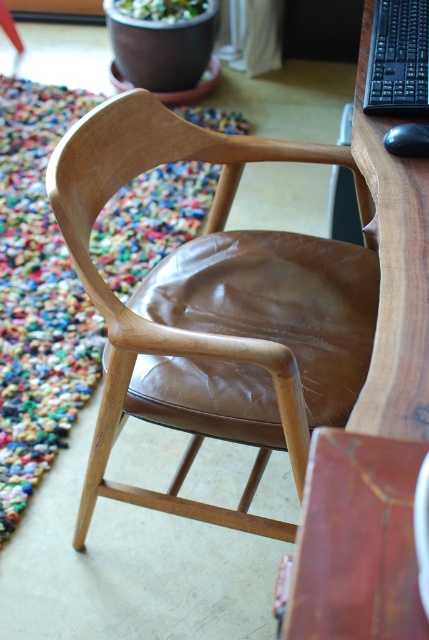
Question: Which of the following is the farthest from the observer?

Choices:
 (A) [211, 417]
 (B) [407, 289]

Answer: (A)

Question: Which point is closer to the camera taking this photo?

Choices:
 (A) (359, 109)
 (B) (232, 168)
 (C) (414, 4)

Answer: (A)

Question: Is the position of brown leather armchair at center more distant than that of wooden computer desk at right?

Choices:
 (A) no
 (B) yes

Answer: (B)

Question: Is brown leather armchair at center smaller than wooden computer desk at right?

Choices:
 (A) no
 (B) yes

Answer: (A)

Question: Is brown leather armchair at center to the left of black plastic keyboard at upper right from the viewer's perspective?

Choices:
 (A) no
 (B) yes

Answer: (B)

Question: Which point is closer to the camera?

Choices:
 (A) (353, 150)
 (B) (187, 515)

Answer: (A)